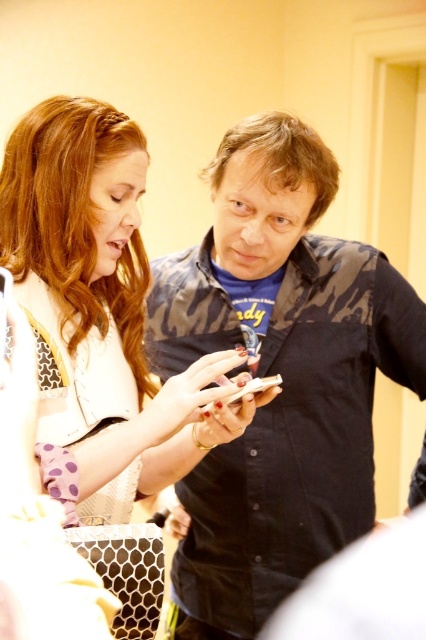
Question: Can you confirm if camo-patterned shirt at center is smaller than white textured shirt at center?

Choices:
 (A) no
 (B) yes

Answer: (A)

Question: Can you confirm if camo-patterned shirt at center is positioned to the left of white textured shirt at center?

Choices:
 (A) yes
 (B) no

Answer: (B)

Question: Which point is closer to the camera?

Choices:
 (A) (135, 426)
 (B) (206, 531)

Answer: (A)

Question: Among these points, which one is farthest from the camera?

Choices:
 (A) (253, 465)
 (B) (135, 224)

Answer: (A)

Question: Can you confirm if camo-patterned shirt at center is positioned to the left of white textured shirt at center?

Choices:
 (A) no
 (B) yes

Answer: (A)